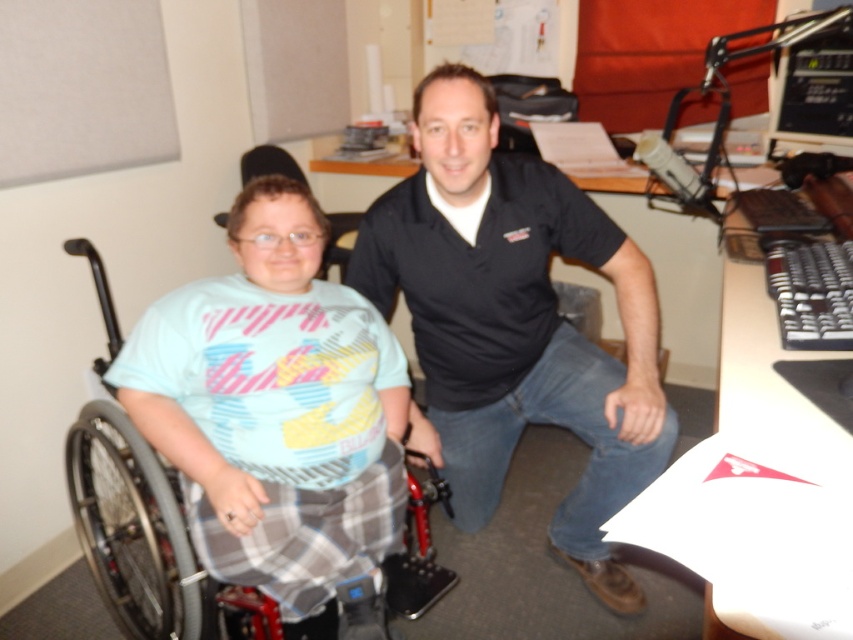
Is point (476, 477) positioned before point (169, 522)?

No, it is not.

Where is `black cotton shirt at center`? The width and height of the screenshot is (853, 640). black cotton shirt at center is located at coordinates (514, 323).

Does black cotton shirt at center appear on the right side of black plastic monitor at upper right?

In fact, black cotton shirt at center is to the left of black plastic monitor at upper right.

Which is below, black cotton shirt at center or black plastic monitor at upper right?

Positioned lower is black cotton shirt at center.

The height and width of the screenshot is (640, 853). In order to click on black cotton shirt at center in this screenshot , I will do `click(514, 323)`.

Is metallic gray wheelchair at left closer to camera compared to black plastic monitor at upper right?

Yes, it is in front of black plastic monitor at upper right.

In order to click on metallic gray wheelchair at left in this screenshot , I will do `click(144, 536)`.

The image size is (853, 640). What are the coordinates of `metallic gray wheelchair at left` in the screenshot? It's located at click(144, 536).